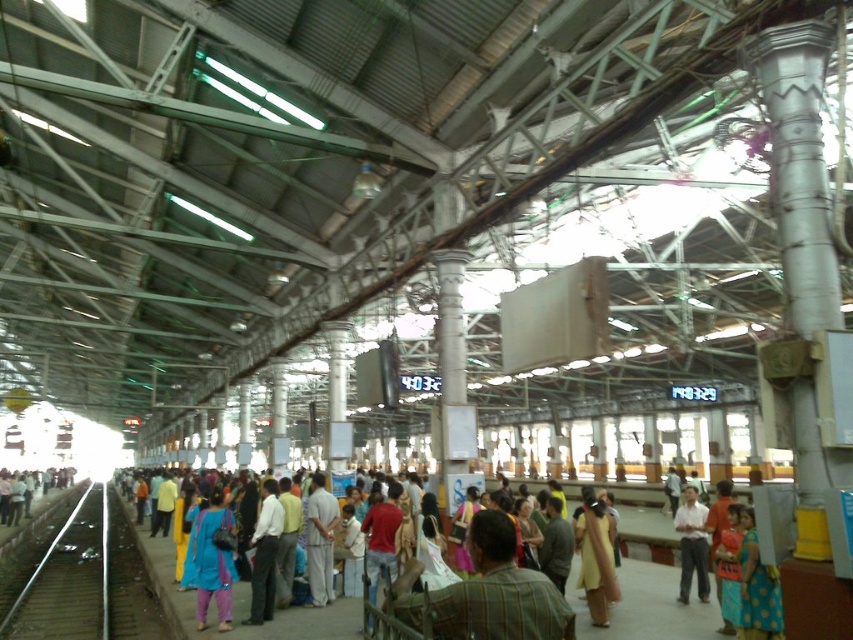
Question: Which of these objects is positioned farthest from the yellow cotton dress at center?

Choices:
 (A) matte blue dress at center
 (B) light brown fabric shirt at center

Answer: (A)

Question: Does smooth metal train track at left have a larger size compared to light brown fabric shirt at center?

Choices:
 (A) no
 (B) yes

Answer: (B)

Question: Estimate the real-world distances between objects in this image. Which object is closer to the light blue fabric dress at center?

Choices:
 (A) light brown fabric shirt at center
 (B) light gray cotton shirt at center
 (C) smooth metal train track at left
 (D) yellow cotton dress at center

Answer: (A)

Question: Which point is closer to the camera taking this photo?

Choices:
 (A) (688, 492)
 (B) (93, 513)

Answer: (A)

Question: Does light blue fabric dress at center appear under matte blue dress at center?

Choices:
 (A) no
 (B) yes

Answer: (B)

Question: Is light gray cotton shirt at center positioned before light brown fabric shirt at center?

Choices:
 (A) no
 (B) yes

Answer: (A)